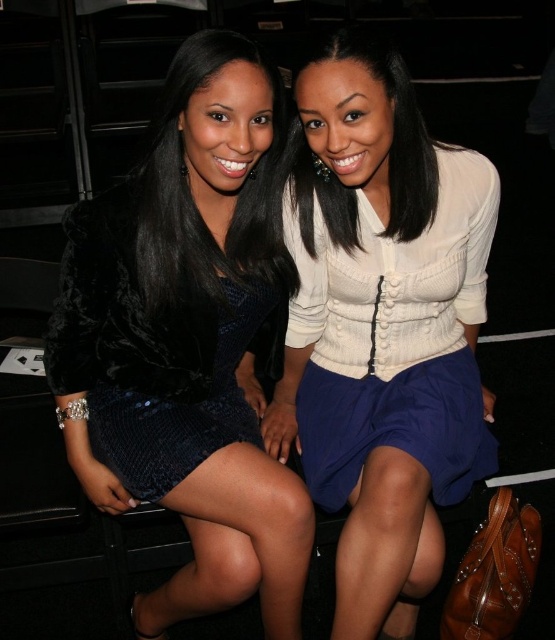
You are a fashion designer who needs to create a new dress collection. You observe the velvet black dress at left and the black sequined dress at center in the image. Which dress would you choose to base your design on if you want to create a more voluminous style?

The velvet black dress at left has a larger size compared to the black sequined dress at center, so choosing the velvet black dress at left would be better for creating a more voluminous style.

You are a photographer trying to adjust the lighting for a closeup shot of the two women. You need to ensure the white knit cardigan at center and the satin white blouse at center are both well lit. Since the cardigan is to the right of the blouse, which direction should you position the main light source to evenly illuminate both garments?

The white knit cardigan at center is to the right of the satin white blouse at center. To evenly illuminate both garments, position the main light source to the left of the subjects so that it reaches both the blouse and the cardigan effectively.